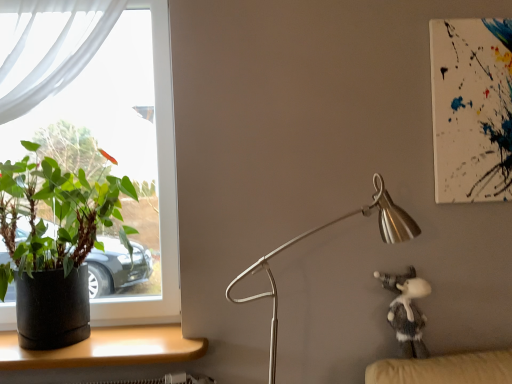
Question: From a real-world perspective, is clear glass window at left positioned under fuzzy gray plush at lower right based on gravity?

Choices:
 (A) no
 (B) yes

Answer: (A)

Question: Is clear glass window at left positioned with its back to fuzzy gray plush at lower right?

Choices:
 (A) yes
 (B) no

Answer: (B)

Question: Does clear glass window at left have a smaller size compared to fuzzy gray plush at lower right?

Choices:
 (A) no
 (B) yes

Answer: (A)

Question: Is clear glass window at left shorter than fuzzy gray plush at lower right?

Choices:
 (A) yes
 (B) no

Answer: (B)

Question: Can you confirm if clear glass window at left is wider than fuzzy gray plush at lower right?

Choices:
 (A) no
 (B) yes

Answer: (B)

Question: Can you see clear glass window at left touching fuzzy gray plush at lower right?

Choices:
 (A) no
 (B) yes

Answer: (A)

Question: From a real-world perspective, is fuzzy gray plush at lower right positioned over clear glass window at left based on gravity?

Choices:
 (A) yes
 (B) no

Answer: (B)

Question: From a real-world perspective, is fuzzy gray plush at lower right located beneath clear glass window at left?

Choices:
 (A) yes
 (B) no

Answer: (A)

Question: Is the surface of fuzzy gray plush at lower right in direct contact with clear glass window at left?

Choices:
 (A) yes
 (B) no

Answer: (B)

Question: From the image's perspective, is fuzzy gray plush at lower right on top of clear glass window at left?

Choices:
 (A) yes
 (B) no

Answer: (B)

Question: Is fuzzy gray plush at lower right facing towards clear glass window at left?

Choices:
 (A) no
 (B) yes

Answer: (A)

Question: Could clear glass window at left be considered to be inside fuzzy gray plush at lower right?

Choices:
 (A) yes
 (B) no

Answer: (B)

Question: Is wooden desk at lower left positioned with its back to silver metallic lamp at center-right?

Choices:
 (A) no
 (B) yes

Answer: (A)